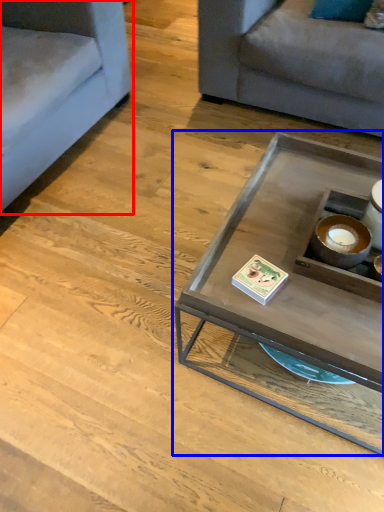
Question: Which object is closer to the camera taking this photo, studio couch (highlighted by a red box) or coffee table (highlighted by a blue box)?

Choices:
 (A) studio couch
 (B) coffee table

Answer: (B)